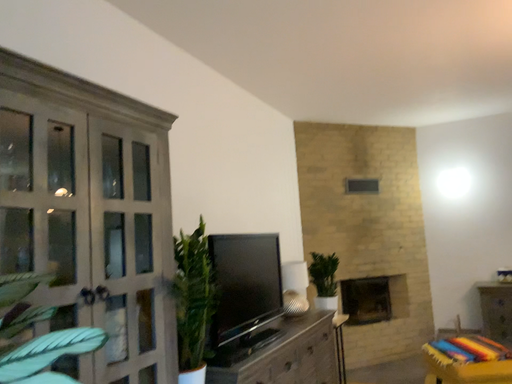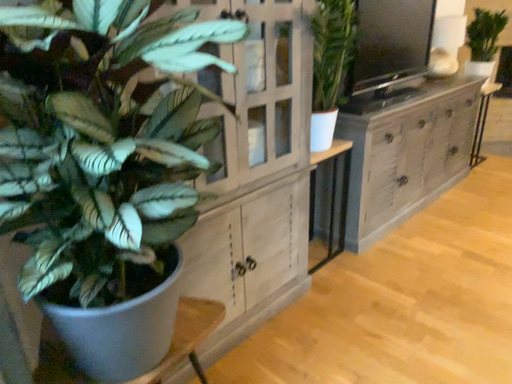
Question: Which way did the camera rotate in the video?

Choices:
 (A) rotated left
 (B) rotated right

Answer: (A)